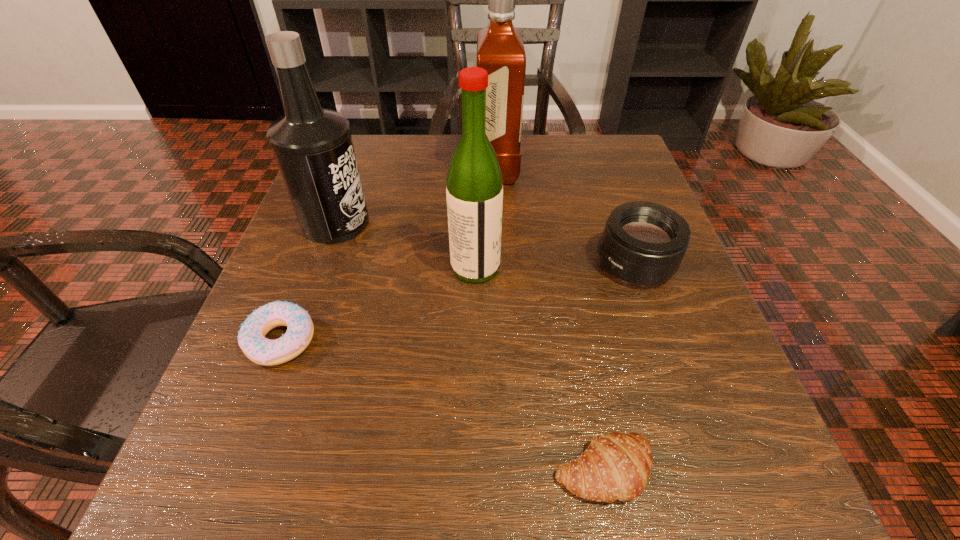
The image size is (960, 540). I want to click on vacant position at the near right corner of the desktop, so click(x=734, y=511).

Locate an element on the screen. The height and width of the screenshot is (540, 960). blank region between the crescent roll and the telephoto lens is located at coordinates (619, 367).

Locate an element on the screen. The height and width of the screenshot is (540, 960). vacant point located between the doughnut and the second nearest liquor is located at coordinates (308, 282).

Identify the location of empty location between the nearest object and the farthest liquor. This screenshot has width=960, height=540. (550, 320).

You are a GUI agent. You are given a task and a screenshot of the screen. Output one action in this format:
    pyautogui.click(x=<x>, y=<y>)
    Task: Click on the vacant area between the crescent roll and the farthest liquor
    This screenshot has width=960, height=540.
    Given the screenshot: What is the action you would take?
    pyautogui.click(x=550, y=320)

This screenshot has width=960, height=540. I want to click on empty space that is in between the telephoto lens and the farthest object, so click(565, 217).

I want to click on blank region between the second nearest object and the crescent roll, so click(442, 406).

Find the location of a particular element. empty space that is in between the telephoto lens and the nearest liquor is located at coordinates (555, 266).

Image resolution: width=960 pixels, height=540 pixels. What are the coordinates of `free space between the leftmost liquor and the nearest object` in the screenshot? It's located at (469, 347).

At what (x,y) coordinates should I click in order to perform the action: click on object that is the closest to the doughnut. Please return your answer as a coordinate pair (x, y). The width and height of the screenshot is (960, 540). Looking at the image, I should click on (313, 146).